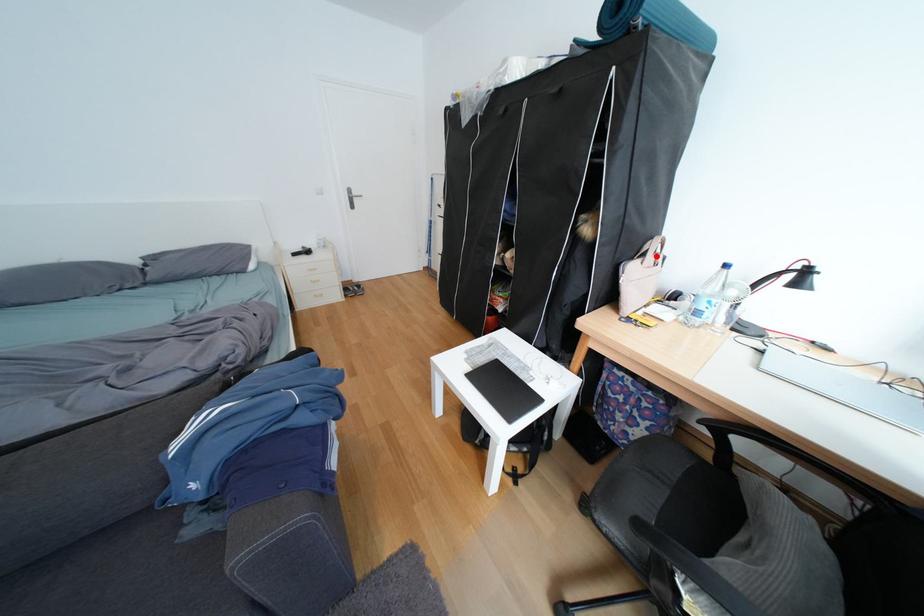
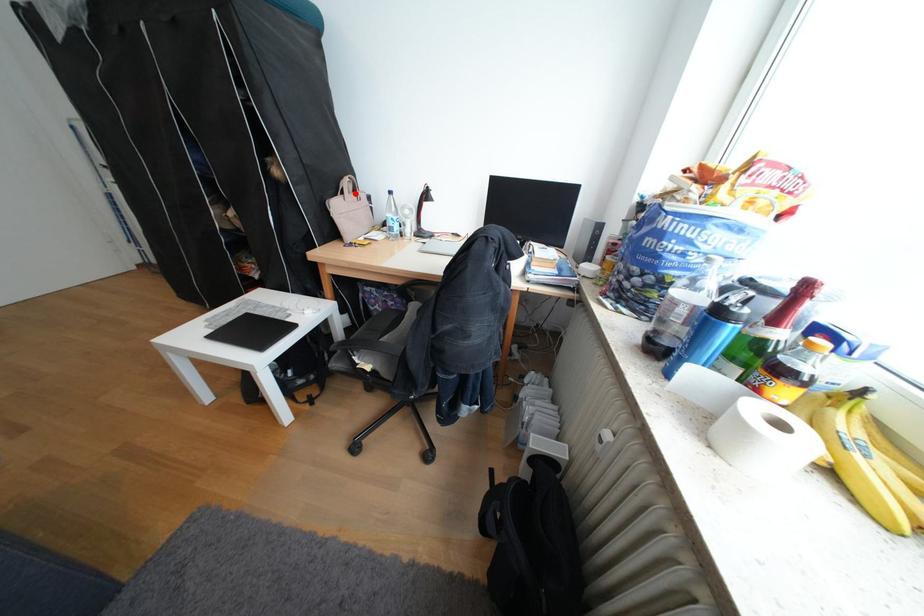
I am providing you with two images of the same scene from different viewpoints. A red point is marked on the first image and another point is marked on the second image. Is the marked point in image1 the same physical position as the marked point in image2?

Yes